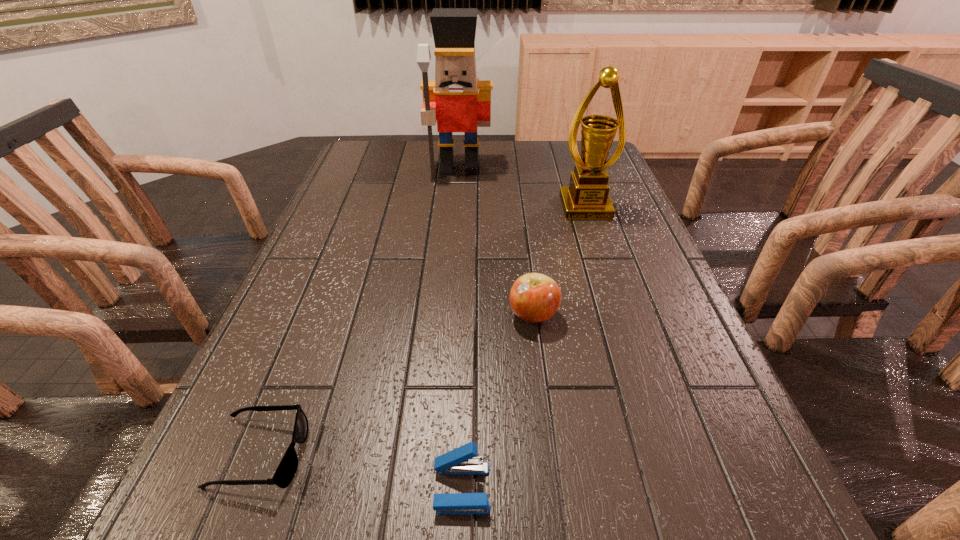
Where is `vacant point located between the nutcracker and the shortest object`? The height and width of the screenshot is (540, 960). vacant point located between the nutcracker and the shortest object is located at coordinates (359, 312).

Locate an element on the screen. This screenshot has height=540, width=960. the third closest object to the leftmost object is located at coordinates (587, 197).

Locate an element on the screen. the closest object to the sunglasses is located at coordinates (461, 461).

What are the coordinates of `free space in the image that satisfies the following two spatial constraints: 1. on the front-facing side of the shortest object; 2. on the right side of the stapler` in the screenshot? It's located at (247, 488).

Image resolution: width=960 pixels, height=540 pixels. What are the coordinates of `free space that satisfies the following two spatial constraints: 1. on the front-facing side of the award; 2. on the front-facing side of the leftmost object` in the screenshot? It's located at (668, 454).

Where is `blank area in the image that satisfies the following two spatial constraints: 1. on the front-facing side of the second farthest object; 2. on the front-facing side of the sunglasses`? blank area in the image that satisfies the following two spatial constraints: 1. on the front-facing side of the second farthest object; 2. on the front-facing side of the sunglasses is located at coordinates (668, 454).

Locate an element on the screen. free location that satisfies the following two spatial constraints: 1. on the front-facing side of the stapler; 2. on the right side of the shortest object is located at coordinates (247, 488).

The height and width of the screenshot is (540, 960). I want to click on vacant point that satisfies the following two spatial constraints: 1. in front of the apple holding the staff; 2. on the left side of the nutcracker, so click(x=448, y=315).